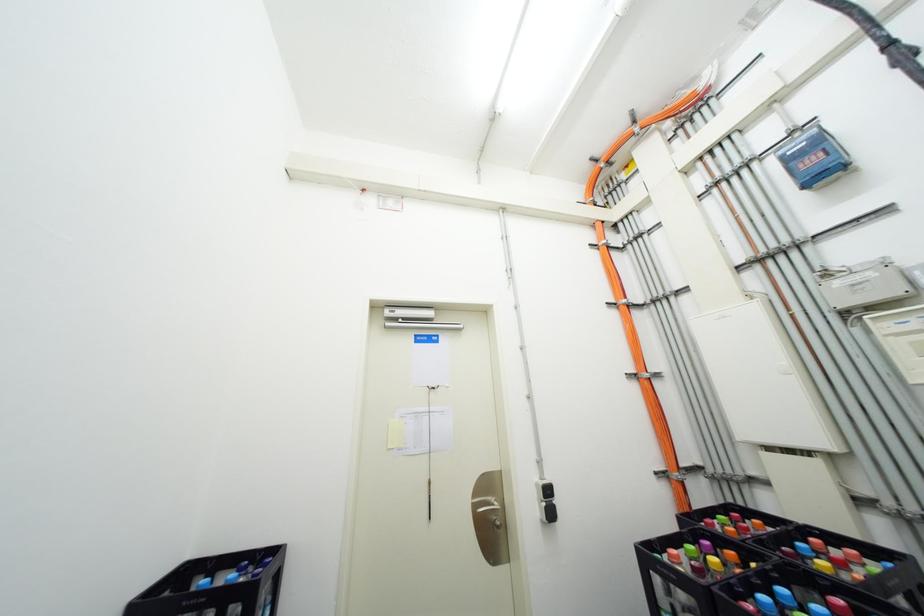
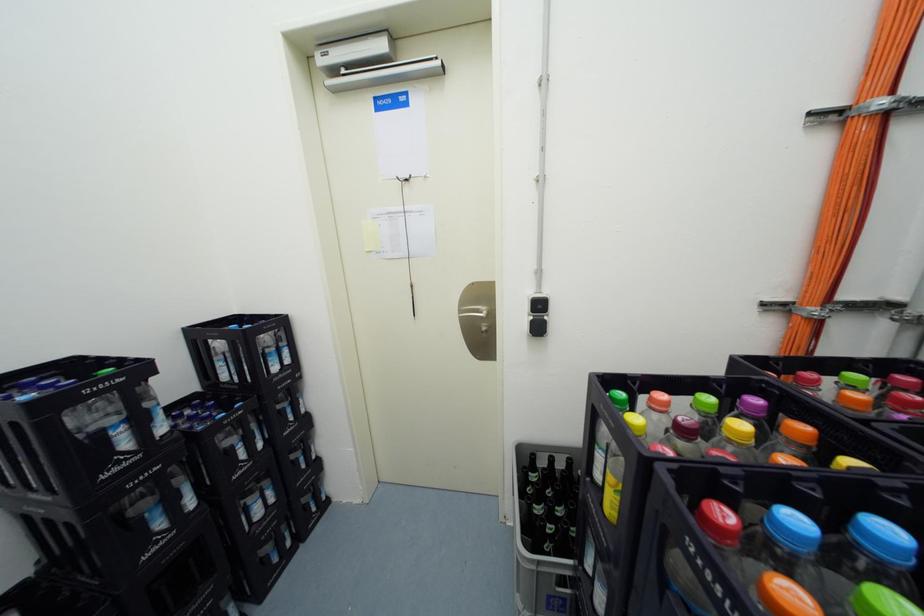
From the picture: The first image is from the beginning of the video and the second image is from the end. How did the camera likely rotate when shooting the video?

The camera's rotation is toward left-down.